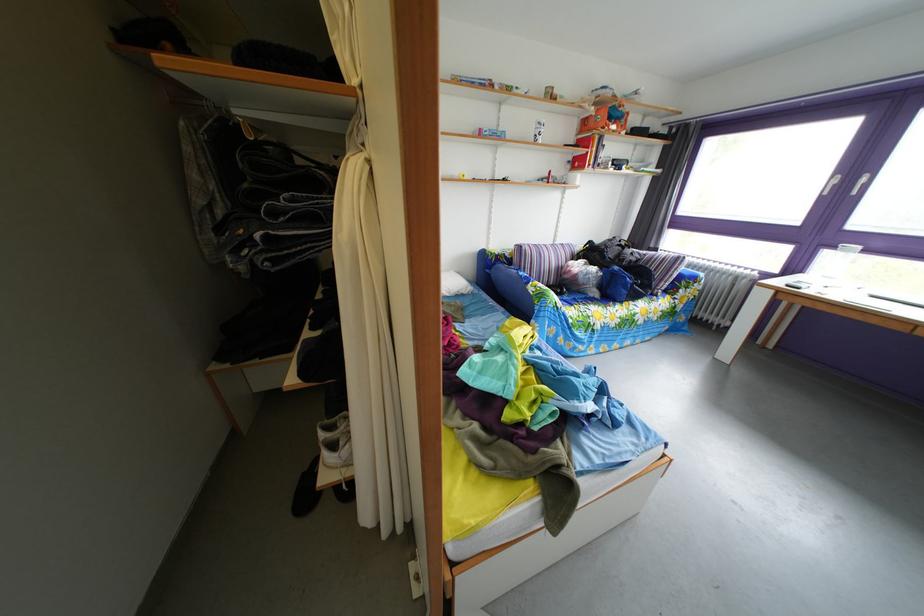
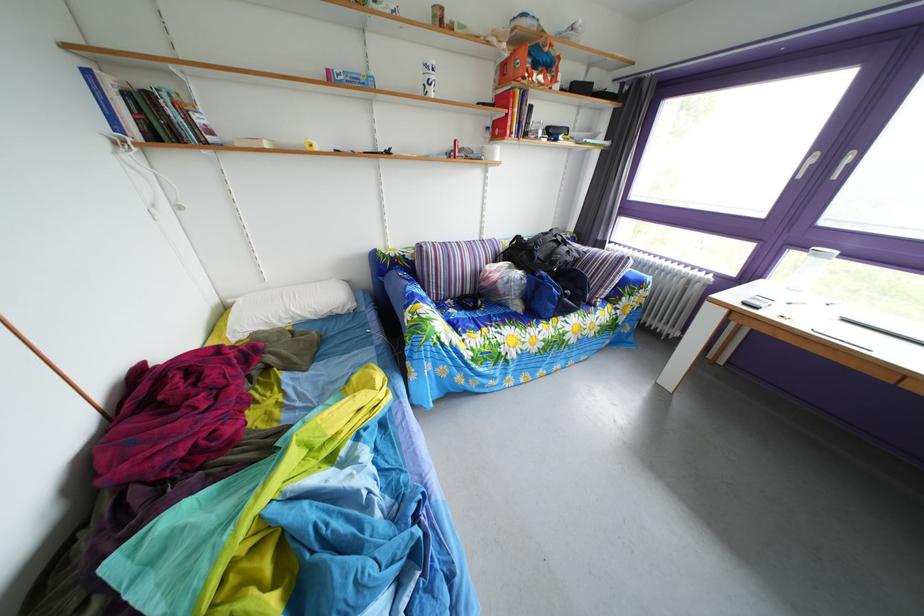
Where in the second image is the point corresponding to [627,276] from the first image?

(553, 282)